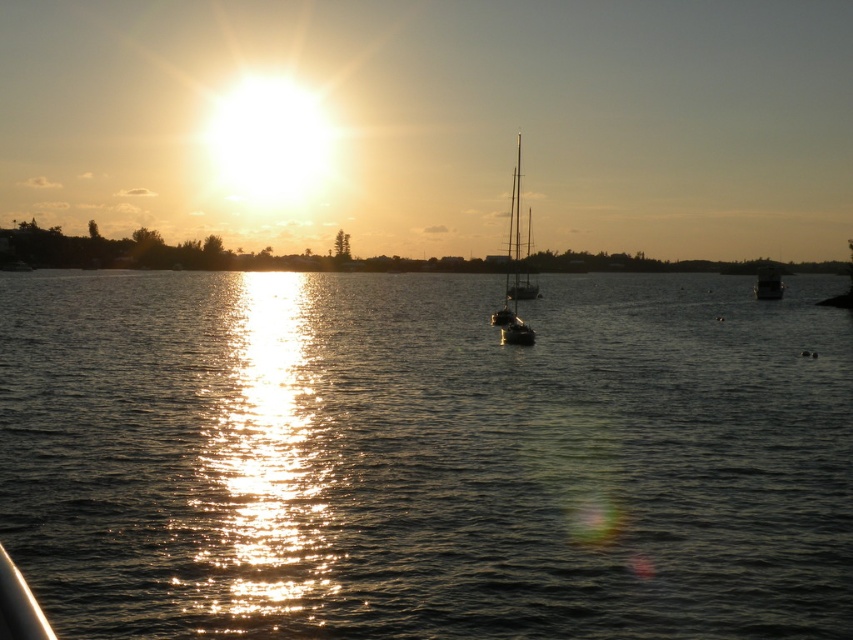
You are a photographer standing at the shore and want to capture both the silhouette sailboat at center and the metallic silver boat at right in a single wide shot. Based on their distance, do you think they can both fit in your camera frame if your camera has a 50mm lens?

The silhouette sailboat at center is 44.31 meters away from the metallic silver boat at right. With a 50mm lens, which has a moderate field of view, it is possible to capture both boats in a single frame if positioned appropriately, as 44.31 meters apart at that distance may fall within the lens capabilities depending on the camera sensor size. However, precise framing would be necessary to ensure both are included.

You are a photographer wanting to capture the sunset reflection on the water. You notice the shiny reflective water at center and the metallic silver boat at right. Which object should you focus on to get the best reflection of the sunset?

The shiny reflective water at center is in front of the metallic silver boat at right, so focusing on the shiny reflective water at center will provide the best reflection of the sunset.